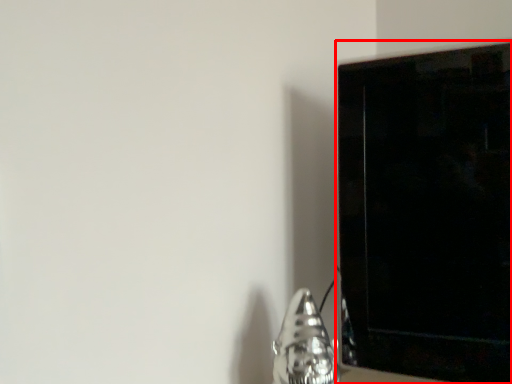
Question: From the image's perspective, where is furniture (annotated by the red box) located in relation to silver in the image?

Choices:
 (A) above
 (B) below

Answer: (A)